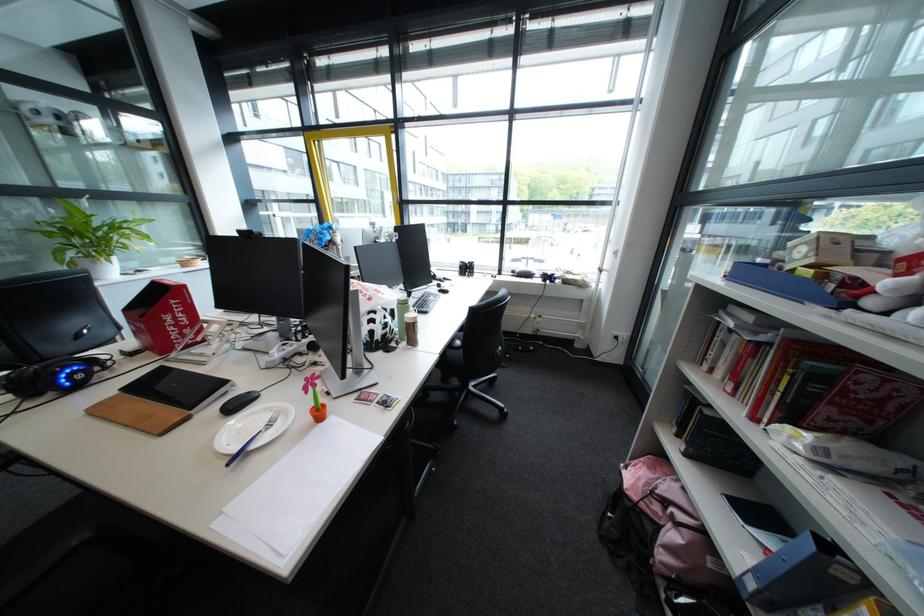
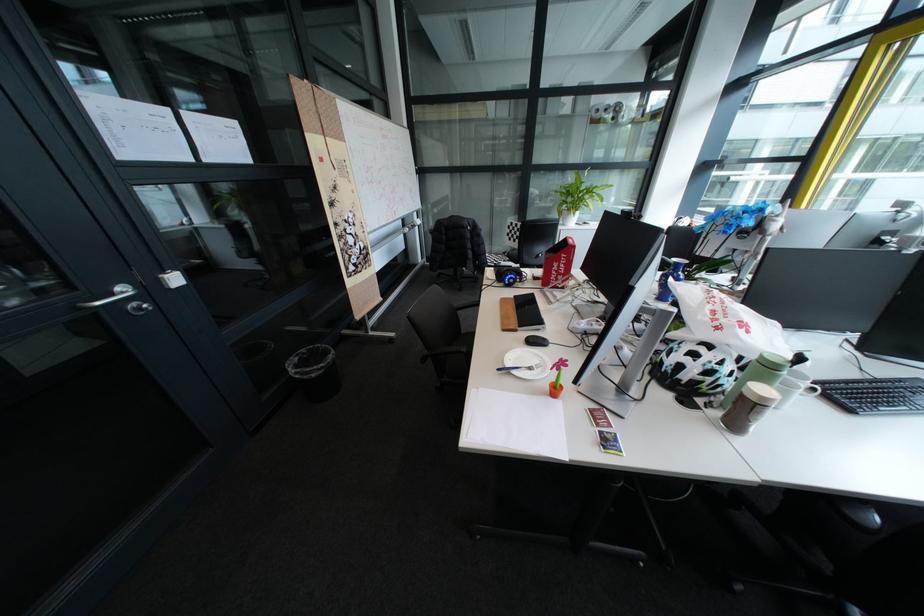
Locate, in the second image, the point that corresponds to pixel 249 407 in the first image.

(546, 342)